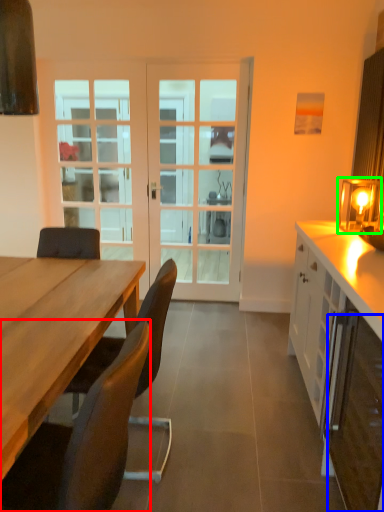
Question: Based on their relative distances, which object is nearer to chair (highlighted by a red box)? Choose from cabinetry (highlighted by a blue box) and table lamp (highlighted by a green box).

Choices:
 (A) cabinetry
 (B) table lamp

Answer: (A)